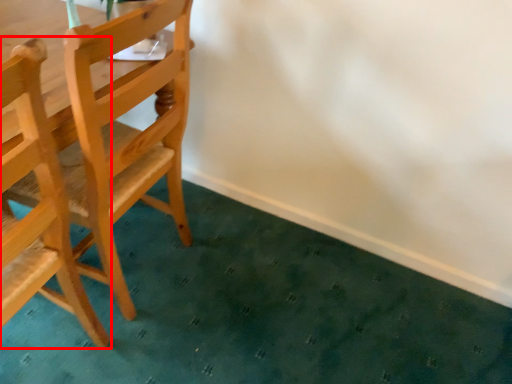
Question: From the image, what is the correct spatial relationship of chair (annotated by the red box) in relation to chair?

Choices:
 (A) right
 (B) left

Answer: (B)